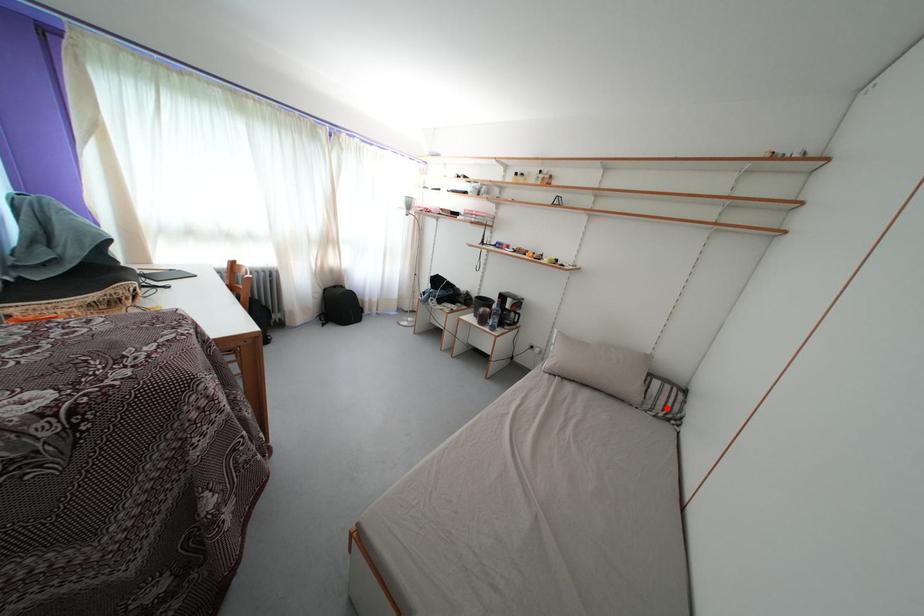
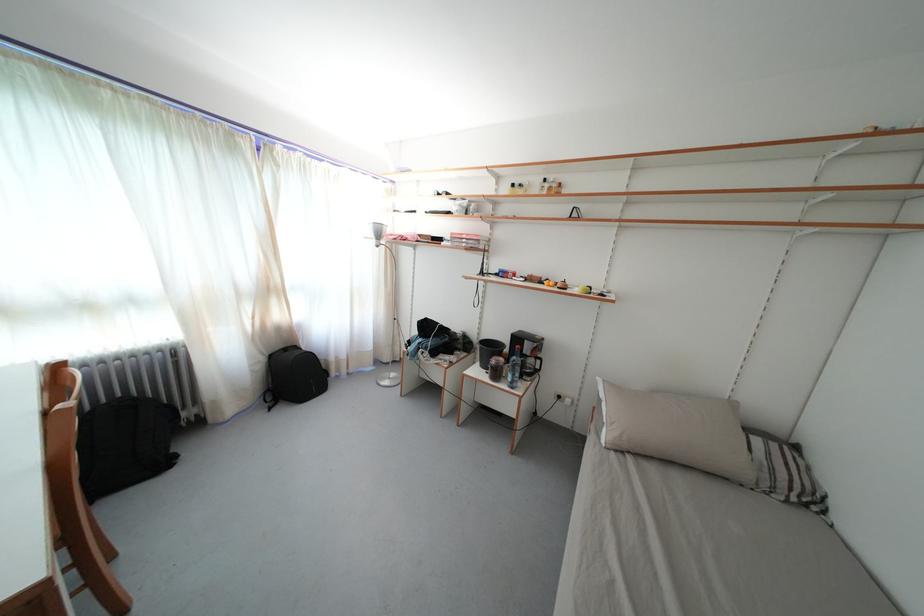
The point at the highlighted location is marked in the first image. Where is the corresponding point in the second image?

(788, 482)